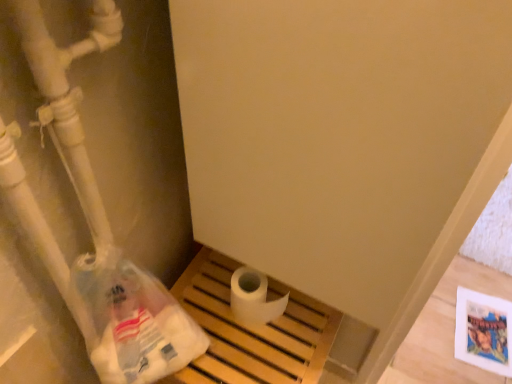
Question: From the image's perspective, is translucent plastic bag at lower left over white matte toilet paper at center?

Choices:
 (A) yes
 (B) no

Answer: (B)

Question: From a real-world perspective, is translucent plastic bag at lower left physically above white matte toilet paper at center?

Choices:
 (A) no
 (B) yes

Answer: (B)

Question: Can you confirm if translucent plastic bag at lower left is bigger than white matte toilet paper at center?

Choices:
 (A) yes
 (B) no

Answer: (A)

Question: Is translucent plastic bag at lower left positioned far away from white matte toilet paper at center?

Choices:
 (A) yes
 (B) no

Answer: (B)

Question: Is translucent plastic bag at lower left oriented away from white matte toilet paper at center?

Choices:
 (A) yes
 (B) no

Answer: (A)

Question: Is translucent plastic bag at lower left wider than white matte toilet paper at center?

Choices:
 (A) yes
 (B) no

Answer: (A)

Question: Is white matte toilet paper at center positioned behind translucent plastic bag at lower left?

Choices:
 (A) no
 (B) yes

Answer: (B)

Question: Does white matte toilet paper at center have a smaller size compared to translucent plastic bag at lower left?

Choices:
 (A) yes
 (B) no

Answer: (A)

Question: Is white matte toilet paper at center to the left of translucent plastic bag at lower left from the viewer's perspective?

Choices:
 (A) yes
 (B) no

Answer: (B)

Question: Can you confirm if white matte toilet paper at center is taller than translucent plastic bag at lower left?

Choices:
 (A) yes
 (B) no

Answer: (B)

Question: Is white matte toilet paper at center bigger than translucent plastic bag at lower left?

Choices:
 (A) yes
 (B) no

Answer: (B)

Question: Does white matte toilet paper at center appear on the right side of translucent plastic bag at lower left?

Choices:
 (A) no
 (B) yes

Answer: (B)

Question: Looking at their shapes, would you say white matte toilet paper at center is wider or thinner than translucent plastic bag at lower left?

Choices:
 (A) thin
 (B) wide

Answer: (A)